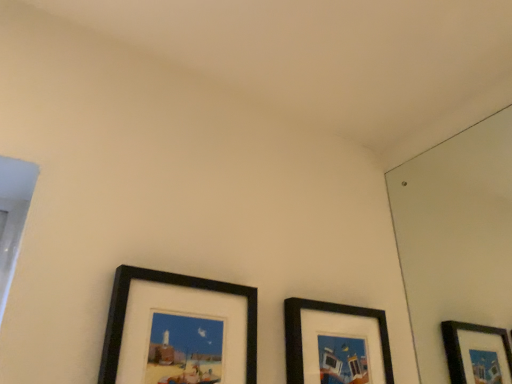
You are a GUI agent. You are given a task and a screenshot of the screen. Output one action in this format:
    pyautogui.click(x=<x>, y=<y>)
    Task: Click on the black matte picture frame at center, arranged as the first picture frame when viewed from the right
    
    Given the screenshot: What is the action you would take?
    pyautogui.click(x=325, y=311)

Describe the element at coordinates (325, 311) in the screenshot. I see `black matte picture frame at center, the second picture frame in the left-to-right sequence` at that location.

Describe the element at coordinates (175, 285) in the screenshot. The width and height of the screenshot is (512, 384). I see `black matte picture frame at lower left, acting as the 2th picture frame starting from the right` at that location.

From the picture: In order to face black matte picture frame at lower left, acting as the 2th picture frame starting from the right, should I rotate leftwards or rightwards?

It's best to rotate left around 9.487 degrees.

You are a GUI agent. You are given a task and a screenshot of the screen. Output one action in this format:
    pyautogui.click(x=<x>, y=<y>)
    Task: Click on the black matte picture frame at lower left, acting as the 2th picture frame starting from the right
    This screenshot has height=384, width=512.
    Given the screenshot: What is the action you would take?
    pyautogui.click(x=175, y=285)

The height and width of the screenshot is (384, 512). Find the location of `black matte picture frame at center, the second picture frame in the left-to-right sequence`. black matte picture frame at center, the second picture frame in the left-to-right sequence is located at coordinates (325, 311).

Between black matte picture frame at center, arranged as the first picture frame when viewed from the right, and black matte picture frame at lower left, the 1th picture frame in the left-to-right sequence, which one appears on the left side from the viewer's perspective?

Positioned to the left is black matte picture frame at lower left, the 1th picture frame in the left-to-right sequence.

Which object is closer to the camera, black matte picture frame at center, arranged as the first picture frame when viewed from the right, or black matte picture frame at lower left, acting as the 2th picture frame starting from the right?

Positioned in front is black matte picture frame at lower left, acting as the 2th picture frame starting from the right.

Considering the positions of point (294, 315) and point (116, 317), is point (294, 315) closer or farther from the camera than point (116, 317)?

Point (294, 315) is farther from the camera than point (116, 317).

From the image's perspective, is black matte picture frame at center, arranged as the first picture frame when viewed from the right, over black matte picture frame at lower left, the 1th picture frame in the left-to-right sequence?

Actually, black matte picture frame at center, arranged as the first picture frame when viewed from the right, appears below black matte picture frame at lower left, the 1th picture frame in the left-to-right sequence, in the image.

From a real-world perspective, is black matte picture frame at center, the second picture frame in the left-to-right sequence, physically above black matte picture frame at lower left, acting as the 2th picture frame starting from the right?

No, from a real-world perspective, black matte picture frame at center, the second picture frame in the left-to-right sequence, is not on top of black matte picture frame at lower left, acting as the 2th picture frame starting from the right.

Which object is wider, black matte picture frame at center, the second picture frame in the left-to-right sequence, or black matte picture frame at lower left, acting as the 2th picture frame starting from the right?

black matte picture frame at lower left, acting as the 2th picture frame starting from the right.

Who is shorter, black matte picture frame at center, arranged as the first picture frame when viewed from the right, or black matte picture frame at lower left, acting as the 2th picture frame starting from the right?

With less height is black matte picture frame at center, arranged as the first picture frame when viewed from the right.

Considering the sizes of objects black matte picture frame at center, arranged as the first picture frame when viewed from the right, and black matte picture frame at lower left, acting as the 2th picture frame starting from the right, in the image provided, who is bigger, black matte picture frame at center, arranged as the first picture frame when viewed from the right, or black matte picture frame at lower left, acting as the 2th picture frame starting from the right,?

black matte picture frame at lower left, acting as the 2th picture frame starting from the right.

From the picture: Is black matte picture frame at center, the second picture frame in the left-to-right sequence, positioned beyond the bounds of black matte picture frame at lower left, the 1th picture frame in the left-to-right sequence?

black matte picture frame at center, the second picture frame in the left-to-right sequence, is positioned outside black matte picture frame at lower left, the 1th picture frame in the left-to-right sequence.

Is black matte picture frame at center, arranged as the first picture frame when viewed from the right, far from black matte picture frame at lower left, acting as the 2th picture frame starting from the right?

No.

Is black matte picture frame at center, arranged as the first picture frame when viewed from the right, facing away from black matte picture frame at lower left, the 1th picture frame in the left-to-right sequence?

No, black matte picture frame at center, arranged as the first picture frame when viewed from the right, is not facing the opposite direction of black matte picture frame at lower left, the 1th picture frame in the left-to-right sequence.

What's the angular difference between black matte picture frame at center, arranged as the first picture frame when viewed from the right, and black matte picture frame at lower left, acting as the 2th picture frame starting from the right,'s facing directions?

They differ by 1.15 degrees in their facing directions.

The width and height of the screenshot is (512, 384). Identify the location of picture frame behind the black matte picture frame at lower left, acting as the 2th picture frame starting from the right. (325, 311).

Is black matte picture frame at lower left, the 1th picture frame in the left-to-right sequence, to the right of black matte picture frame at center, the second picture frame in the left-to-right sequence, from the viewer's perspective?

Incorrect, black matte picture frame at lower left, the 1th picture frame in the left-to-right sequence, is not on the right side of black matte picture frame at center, the second picture frame in the left-to-right sequence.

Considering the positions of objects black matte picture frame at lower left, the 1th picture frame in the left-to-right sequence, and black matte picture frame at center, the second picture frame in the left-to-right sequence, in the image provided, who is behind, black matte picture frame at lower left, the 1th picture frame in the left-to-right sequence, or black matte picture frame at center, the second picture frame in the left-to-right sequence,?

black matte picture frame at center, the second picture frame in the left-to-right sequence, is more distant.

Which is less distant, (249, 300) or (371, 317)?

Clearly, point (249, 300) is closer to the camera than point (371, 317).

From the image's perspective, does black matte picture frame at lower left, the 1th picture frame in the left-to-right sequence, appear lower than black matte picture frame at center, arranged as the first picture frame when viewed from the right?

Incorrect, from the image's perspective, black matte picture frame at lower left, the 1th picture frame in the left-to-right sequence, is higher than black matte picture frame at center, arranged as the first picture frame when viewed from the right.

From a real-world perspective, does black matte picture frame at lower left, the 1th picture frame in the left-to-right sequence, sit lower than black matte picture frame at center, arranged as the first picture frame when viewed from the right?

No.

Based on the photo, which of these two, black matte picture frame at lower left, acting as the 2th picture frame starting from the right, or black matte picture frame at center, arranged as the first picture frame when viewed from the right, is thinner?

Thinner between the two is black matte picture frame at center, arranged as the first picture frame when viewed from the right.

Between black matte picture frame at lower left, acting as the 2th picture frame starting from the right, and black matte picture frame at center, the second picture frame in the left-to-right sequence, which one has more height?

black matte picture frame at lower left, acting as the 2th picture frame starting from the right.

Can you confirm if black matte picture frame at lower left, the 1th picture frame in the left-to-right sequence, is bigger than black matte picture frame at center, arranged as the first picture frame when viewed from the right?

Yes.

Is black matte picture frame at center, arranged as the first picture frame when viewed from the right, inside black matte picture frame at lower left, the 1th picture frame in the left-to-right sequence?

Definitely not — black matte picture frame at center, arranged as the first picture frame when viewed from the right, is not inside black matte picture frame at lower left, the 1th picture frame in the left-to-right sequence.

Are black matte picture frame at lower left, the 1th picture frame in the left-to-right sequence, and black matte picture frame at center, arranged as the first picture frame when viewed from the right, far apart?

black matte picture frame at lower left, the 1th picture frame in the left-to-right sequence, is actually quite close to black matte picture frame at center, arranged as the first picture frame when viewed from the right.

Does black matte picture frame at lower left, the 1th picture frame in the left-to-right sequence, turn towards black matte picture frame at center, the second picture frame in the left-to-right sequence?

No, black matte picture frame at lower left, the 1th picture frame in the left-to-right sequence, does not turn towards black matte picture frame at center, the second picture frame in the left-to-right sequence.

What's the angular difference between black matte picture frame at lower left, the 1th picture frame in the left-to-right sequence, and black matte picture frame at center, the second picture frame in the left-to-right sequence,'s facing directions?

black matte picture frame at lower left, the 1th picture frame in the left-to-right sequence, and black matte picture frame at center, the second picture frame in the left-to-right sequence, are facing 1.15 degrees away from each other.

Could you measure the distance between black matte picture frame at lower left, the 1th picture frame in the left-to-right sequence, and black matte picture frame at center, the second picture frame in the left-to-right sequence?

They are 9.77 inches apart.

What are the coordinates of `picture frame located above the black matte picture frame at center, the second picture frame in the left-to-right sequence (from a real-world perspective)` in the screenshot? It's located at (175, 285).

Locate an element on the screen. This screenshot has width=512, height=384. picture frame below the black matte picture frame at lower left, the 1th picture frame in the left-to-right sequence (from the image's perspective) is located at coordinates (325, 311).

In the image, there is a black matte picture frame at lower left, the 1th picture frame in the left-to-right sequence. Identify the location of picture frame below it (from a real-world perspective). The width and height of the screenshot is (512, 384). (325, 311).